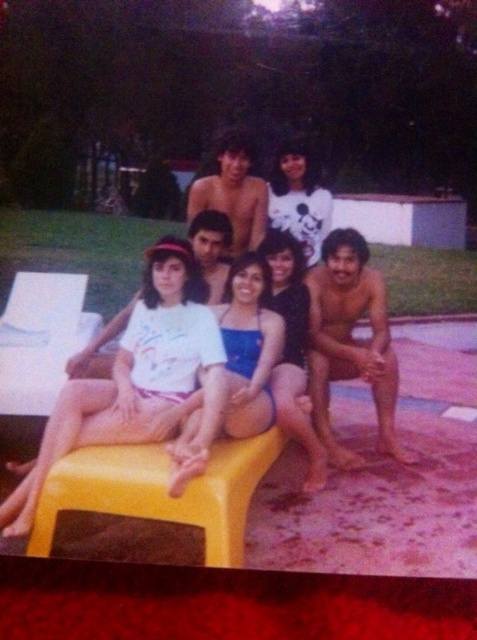
Is matte black bikini top at center bigger than white cotton shirt at upper center?

Yes, matte black bikini top at center is bigger than white cotton shirt at upper center.

The width and height of the screenshot is (477, 640). Describe the element at coordinates (292, 348) in the screenshot. I see `matte black bikini top at center` at that location.

Image resolution: width=477 pixels, height=640 pixels. I want to click on matte black bikini top at center, so click(x=292, y=348).

Is point (148, 305) farther from viewer compared to point (247, 305)?

That is False.

Does white matte t-shirt at center appear over white matte swimsuit at center?

Yes.

The width and height of the screenshot is (477, 640). I want to click on white matte t-shirt at center, so click(x=141, y=381).

Can you confirm if white matte t-shirt at center is positioned above yellow plastic stool at center?

Indeed, white matte t-shirt at center is positioned over yellow plastic stool at center.

How much distance is there between white matte t-shirt at center and yellow plastic stool at center?

white matte t-shirt at center is 10.82 inches away from yellow plastic stool at center.

Between point (28, 516) and point (232, 502), which one is positioned in front?

Positioned in front is point (232, 502).

This screenshot has height=640, width=477. Identify the location of white matte t-shirt at center. click(141, 381).